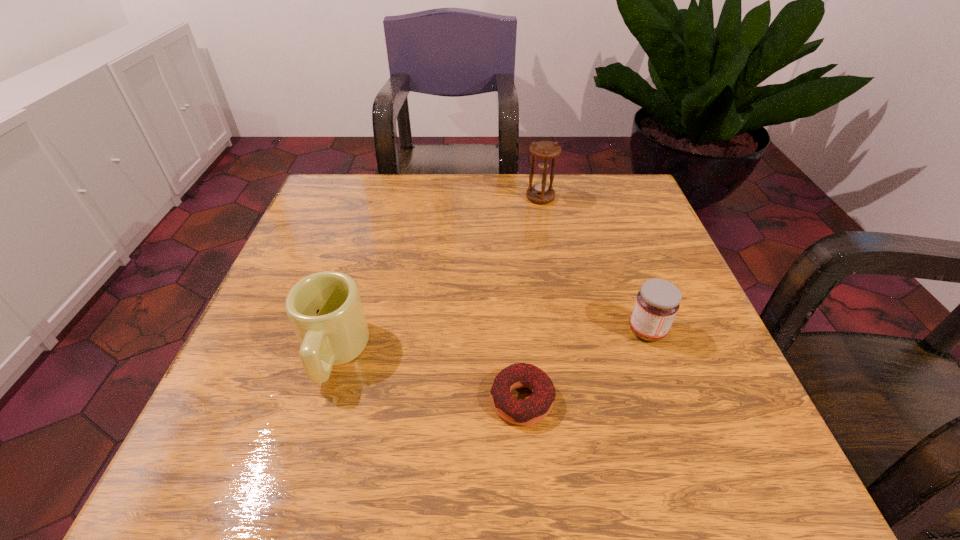
Locate an element on the screen. The height and width of the screenshot is (540, 960). free space between the second shortest object and the third object from left to right is located at coordinates (593, 264).

In order to click on free space between the doughnut and the mug in this screenshot , I will do `click(427, 376)`.

Locate an element on the screen. the third closest object relative to the jam is located at coordinates (325, 310).

The image size is (960, 540). Identify the location of the closest object to the mug. (536, 407).

At what (x,y) coordinates should I click in order to perform the action: click on free space that satisfies the following two spatial constraints: 1. with the handle on the side of the leftmost object; 2. on the right side of the shortest object. Please return your answer as a coordinate pair (x, y). The width and height of the screenshot is (960, 540). Looking at the image, I should click on (320, 400).

Image resolution: width=960 pixels, height=540 pixels. Find the location of `free spot that satisfies the following two spatial constraints: 1. with the handle on the side of the third shortest object; 2. on the right side of the third object from right to left`. free spot that satisfies the following two spatial constraints: 1. with the handle on the side of the third shortest object; 2. on the right side of the third object from right to left is located at coordinates (320, 400).

Image resolution: width=960 pixels, height=540 pixels. I want to click on vacant area in the image that satisfies the following two spatial constraints: 1. with the handle on the side of the second tallest object; 2. on the left side of the doughnut, so click(320, 400).